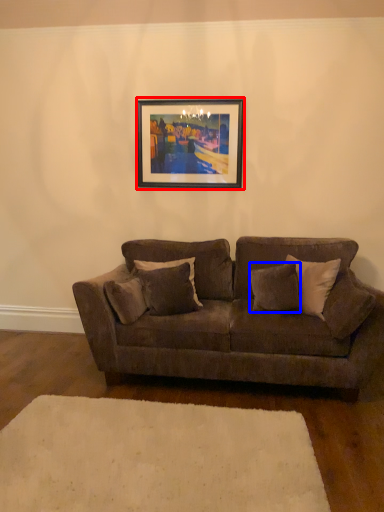
Question: Which of the following is the closest to the observer, picture frame (highlighted by a red box) or pillow (highlighted by a blue box)?

Choices:
 (A) picture frame
 (B) pillow

Answer: (B)